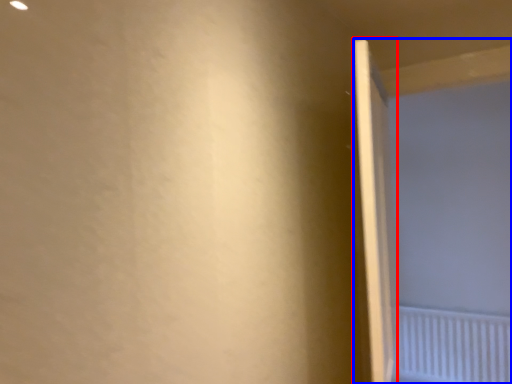
Question: Among these objects, which one is nearest to the camera, door (highlighted by a red box) or screen door (highlighted by a blue box)?

Choices:
 (A) door
 (B) screen door

Answer: (A)